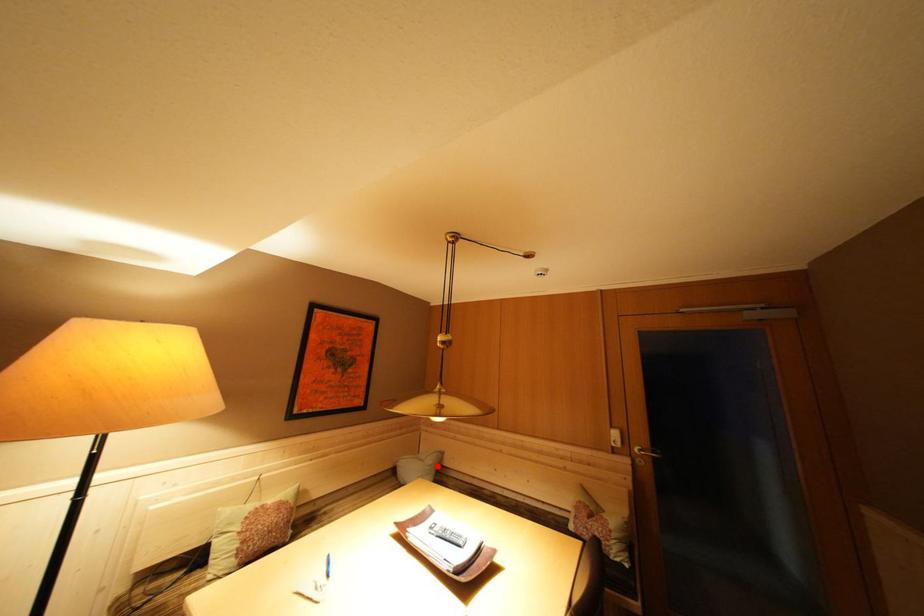
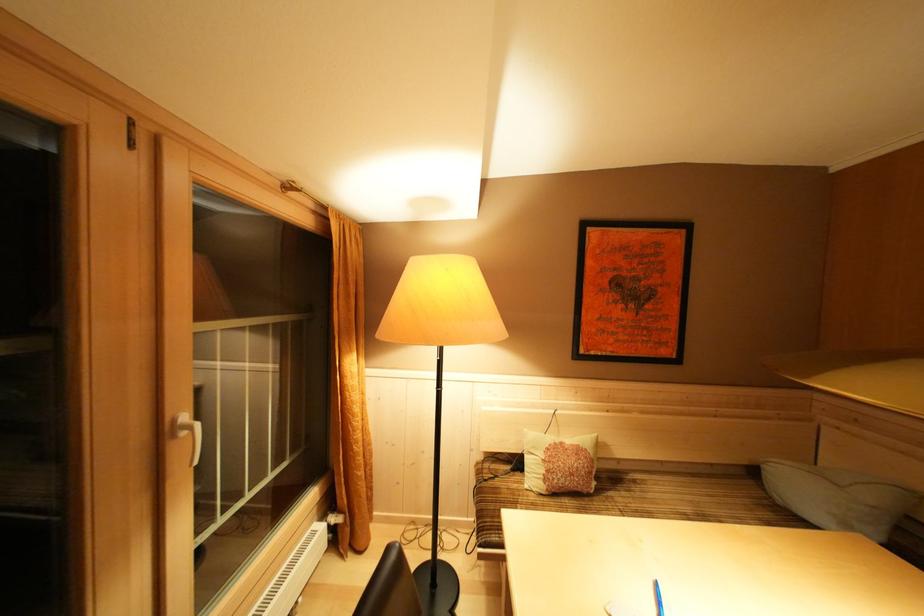
The point at the highlighted location is marked in the first image. Where is the corresponding point in the second image?

(879, 503)